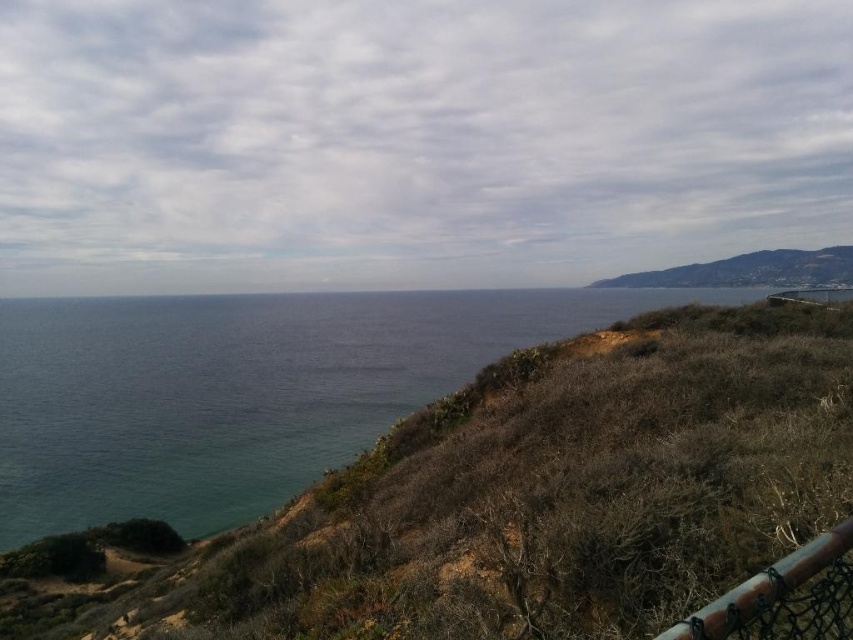
Question: Which of the following is the closest to the observer?

Choices:
 (A) (432, 298)
 (B) (671, 632)

Answer: (B)

Question: Which point is closer to the camera taking this photo?

Choices:
 (A) (318, 465)
 (B) (799, 612)
 (C) (694, 276)

Answer: (B)

Question: Is brown mesh fence at lower right above brown grassy hillside at upper right?

Choices:
 (A) yes
 (B) no

Answer: (B)

Question: Can you confirm if blue water at center is positioned to the left of brown mesh fence at lower right?

Choices:
 (A) yes
 (B) no

Answer: (A)

Question: Which point is closer to the camera?

Choices:
 (A) brown mesh fence at lower right
 (B) blue water at center

Answer: (A)

Question: Can you confirm if blue water at center is smaller than brown mesh fence at lower right?

Choices:
 (A) no
 (B) yes

Answer: (A)